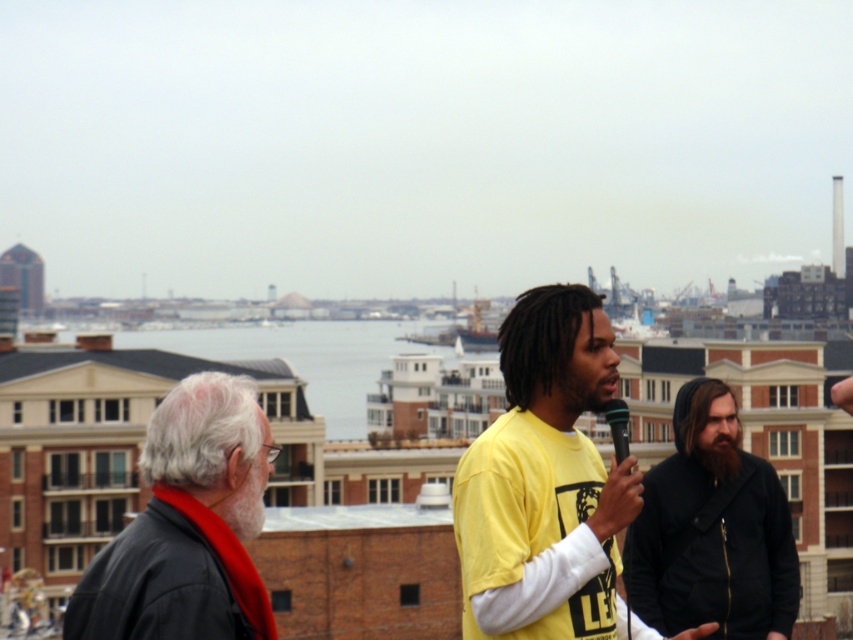
Does black leather jacket at left have a greater width compared to black matte microphone at center?

Correct, the width of black leather jacket at left exceeds that of black matte microphone at center.

Is black leather jacket at left shorter than black matte microphone at center?

Incorrect, black leather jacket at left's height does not fall short of black matte microphone at center's.

Where is `black leather jacket at left`? The image size is (853, 640). black leather jacket at left is located at coordinates (x=189, y=525).

Who is more forward, (x=711, y=541) or (x=622, y=401)?

Positioned in front is point (x=622, y=401).

Is point (625, 552) less distant than point (613, 440)?

Yes.

Which is in front, point (732, 429) or point (618, 404)?

Point (618, 404) is more forward.

Locate an element on the screen. This screenshot has width=853, height=640. black hoodie at center is located at coordinates (712, 529).

Can you confirm if yellow matte shirt at center is smaller than black leather jacket at left?

Correct, yellow matte shirt at center occupies less space than black leather jacket at left.

Can you confirm if yellow matte shirt at center is shorter than black leather jacket at left?

Yes.

Between point (575, 394) and point (113, 548), which one is positioned in front?

Point (113, 548) is more forward.

Image resolution: width=853 pixels, height=640 pixels. Find the location of `yellow matte shirt at center`. yellow matte shirt at center is located at coordinates (544, 480).